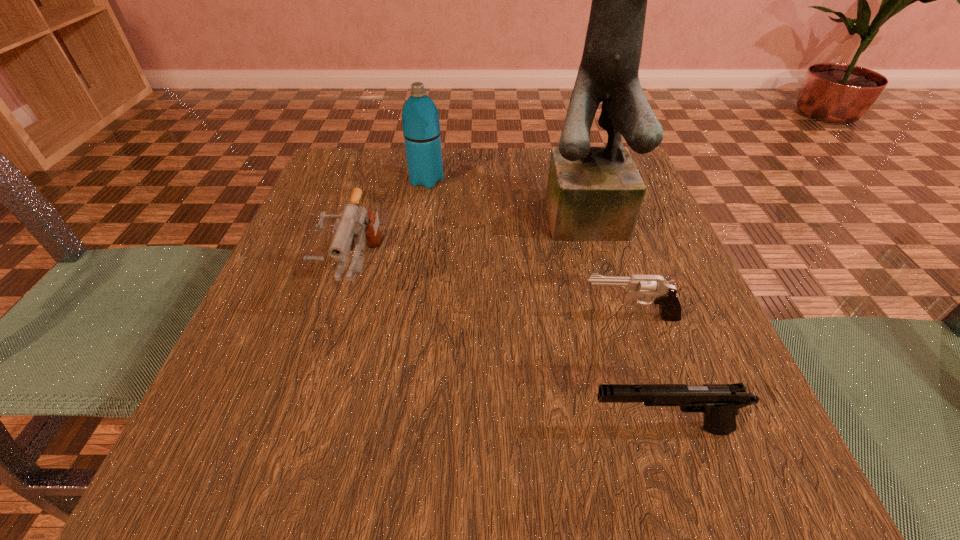
Where is `free space located 0.350m at the aiming end of the nearest object`? free space located 0.350m at the aiming end of the nearest object is located at coordinates (321, 429).

The height and width of the screenshot is (540, 960). I want to click on sculpture at the far edge, so click(593, 193).

Identify the location of thermos bottle present at the far edge. Image resolution: width=960 pixels, height=540 pixels. (421, 128).

I want to click on object at the near edge, so click(x=719, y=402).

This screenshot has height=540, width=960. I want to click on object at the left edge, so click(x=354, y=221).

This screenshot has height=540, width=960. What are the coordinates of `sculpture located in the right edge section of the desktop` in the screenshot? It's located at (593, 193).

Image resolution: width=960 pixels, height=540 pixels. I want to click on object situated at the far right corner, so click(593, 193).

Where is `object located at the near right corner`? The image size is (960, 540). object located at the near right corner is located at coordinates (719, 402).

In the image, there is a desktop. In order to click on vacant space at the far edge in this screenshot , I will do `click(546, 155)`.

The image size is (960, 540). I want to click on free space at the near edge, so click(x=358, y=501).